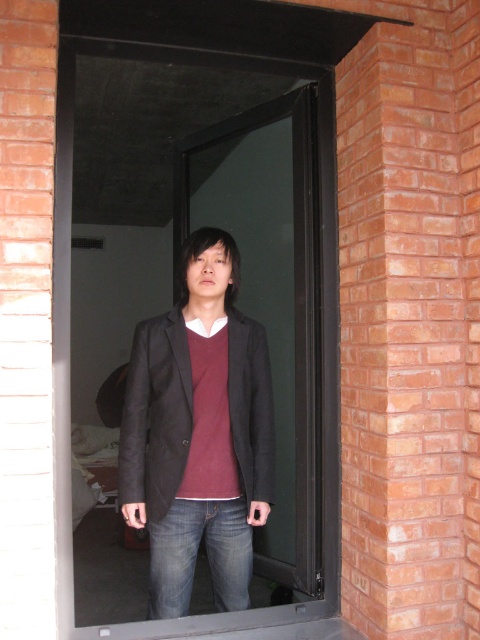
Question: Which object is farther from the camera taking this photo?

Choices:
 (A) matte black blazer at center
 (B) transparent glass door at center

Answer: (B)

Question: Which point is farther to the camera?

Choices:
 (A) (103, 580)
 (B) (180, 461)

Answer: (A)

Question: Does transparent glass door at center appear on the left side of matte black blazer at center?

Choices:
 (A) no
 (B) yes

Answer: (A)

Question: Can you confirm if transparent glass door at center is positioned to the left of matte black blazer at center?

Choices:
 (A) no
 (B) yes

Answer: (A)

Question: From the image, what is the correct spatial relationship of transparent glass door at center in relation to matte black blazer at center?

Choices:
 (A) above
 (B) below

Answer: (A)